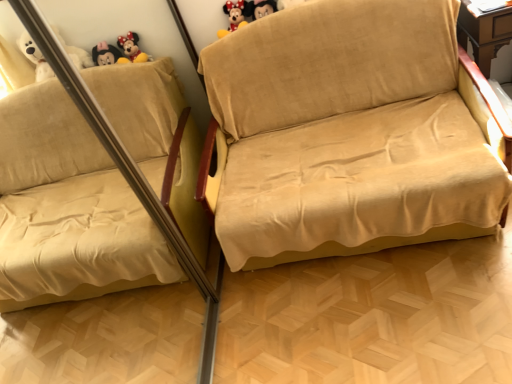
The image size is (512, 384). I want to click on velvet yellow plush toy at upper center, so click(x=234, y=16).

The width and height of the screenshot is (512, 384). What do you see at coordinates (234, 16) in the screenshot?
I see `velvet yellow plush toy at upper center` at bounding box center [234, 16].

You are a GUI agent. You are given a task and a screenshot of the screen. Output one action in this format:
    pyautogui.click(x=<x>, y=<y>)
    Task: Click on the beige fabric couch at center
    The height and width of the screenshot is (384, 512).
    Given the screenshot: What is the action you would take?
    pyautogui.click(x=351, y=133)

What do you see at coordinates (351, 133) in the screenshot?
I see `beige fabric couch at center` at bounding box center [351, 133].

Where is `velvet yellow plush toy at upper center`? velvet yellow plush toy at upper center is located at coordinates (234, 16).

Which object is positioned more to the right, velvet yellow plush toy at upper center or beige fabric couch at center?

From the viewer's perspective, beige fabric couch at center appears more on the right side.

Which object is closer to the camera, velvet yellow plush toy at upper center or beige fabric couch at center?

Positioned in front is beige fabric couch at center.

In the scene shown: Which is less distant, (234, 6) or (302, 167)?

Point (234, 6).

From the image's perspective, is velvet yellow plush toy at upper center on beige fabric couch at center?

Yes, from the image's perspective, velvet yellow plush toy at upper center is over beige fabric couch at center.

From a real-world perspective, relative to beige fabric couch at center, is velvet yellow plush toy at upper center vertically above or below?

velvet yellow plush toy at upper center is situated higher than beige fabric couch at center in the real world.

Considering the sizes of objects velvet yellow plush toy at upper center and beige fabric couch at center in the image provided, who is thinner, velvet yellow plush toy at upper center or beige fabric couch at center?

velvet yellow plush toy at upper center.

Is velvet yellow plush toy at upper center taller than beige fabric couch at center?

Incorrect, the height of velvet yellow plush toy at upper center is not larger of that of beige fabric couch at center.

Considering the sizes of velvet yellow plush toy at upper center and beige fabric couch at center in the image, is velvet yellow plush toy at upper center bigger or smaller than beige fabric couch at center?

Considering their sizes, velvet yellow plush toy at upper center takes up less space than beige fabric couch at center.

Based on the photo, would you say velvet yellow plush toy at upper center is inside or outside beige fabric couch at center?

velvet yellow plush toy at upper center is located inside beige fabric couch at center.

Is velvet yellow plush toy at upper center far from beige fabric couch at center?

No, velvet yellow plush toy at upper center is not far away from beige fabric couch at center.

Could you tell me if velvet yellow plush toy at upper center is facing beige fabric couch at center?

Yes, velvet yellow plush toy at upper center faces towards beige fabric couch at center.

Can you tell me how much velvet yellow plush toy at upper center and beige fabric couch at center differ in facing direction?

There is a 4.53-degree angle between the facing directions of velvet yellow plush toy at upper center and beige fabric couch at center.

Where is `toy above the beige fabric couch at center (from a real-world perspective)`? The image size is (512, 384). toy above the beige fabric couch at center (from a real-world perspective) is located at coordinates (234, 16).

Can you confirm if beige fabric couch at center is positioned to the left of velvet yellow plush toy at upper center?

No, beige fabric couch at center is not to the left of velvet yellow plush toy at upper center.

Which object is more forward, beige fabric couch at center or velvet yellow plush toy at upper center?

beige fabric couch at center.

Does point (279, 180) come behind point (225, 11)?

No.

From the image's perspective, relative to velvet yellow plush toy at upper center, is beige fabric couch at center above or below?

From the image's perspective, beige fabric couch at center appears below velvet yellow plush toy at upper center.

From a real-world perspective, is beige fabric couch at center on top of velvet yellow plush toy at upper center?

No.

Considering the sizes of beige fabric couch at center and velvet yellow plush toy at upper center in the image, is beige fabric couch at center wider or thinner than velvet yellow plush toy at upper center?

beige fabric couch at center is wider than velvet yellow plush toy at upper center.

Who is taller, beige fabric couch at center or velvet yellow plush toy at upper center?

beige fabric couch at center is taller.

Does beige fabric couch at center have a smaller size compared to velvet yellow plush toy at upper center?

Incorrect, beige fabric couch at center is not smaller in size than velvet yellow plush toy at upper center.

Is velvet yellow plush toy at upper center inside beige fabric couch at center?

Yes, velvet yellow plush toy at upper center is a part of beige fabric couch at center.

Is beige fabric couch at center with velvet yellow plush toy at upper center?

No, beige fabric couch at center is not in contact with velvet yellow plush toy at upper center.

Is beige fabric couch at center turned away from velvet yellow plush toy at upper center?

Yes, beige fabric couch at center is facing away from velvet yellow plush toy at upper center.

How many degrees apart are the facing directions of beige fabric couch at center and velvet yellow plush toy at upper center?

They differ by 4.53 degrees in their facing directions.

At what (x,y) coordinates should I click in order to perform the action: click on studio couch that is below the velvet yellow plush toy at upper center (from the image's perspective). Please return your answer as a coordinate pair (x, y). The image size is (512, 384). Looking at the image, I should click on (351, 133).

Locate an element on the screen. The height and width of the screenshot is (384, 512). studio couch in front of the velvet yellow plush toy at upper center is located at coordinates (351, 133).

Identify the location of studio couch located underneath the velvet yellow plush toy at upper center (from a real-world perspective). This screenshot has height=384, width=512. (351, 133).